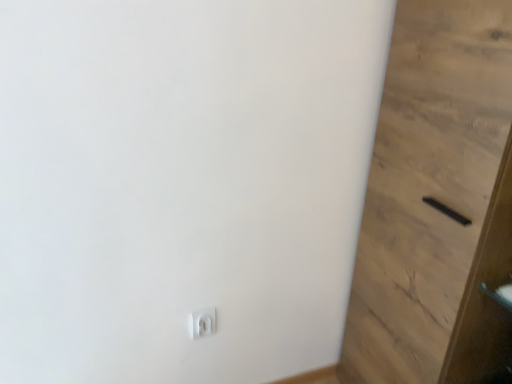
Question: Does black matte door at lower right have a greater height compared to white plastic light switch at lower center?

Choices:
 (A) no
 (B) yes

Answer: (B)

Question: Can you confirm if black matte door at lower right is shorter than white plastic light switch at lower center?

Choices:
 (A) no
 (B) yes

Answer: (A)

Question: Is black matte door at lower right completely or partially outside of white plastic light switch at lower center?

Choices:
 (A) no
 (B) yes

Answer: (B)

Question: Would you say white plastic light switch at lower center is part of black matte door at lower right's contents?

Choices:
 (A) no
 (B) yes

Answer: (A)

Question: Does black matte door at lower right have a greater width compared to white plastic light switch at lower center?

Choices:
 (A) no
 (B) yes

Answer: (B)

Question: Is black matte door at lower right positioned with its back to white plastic light switch at lower center?

Choices:
 (A) no
 (B) yes

Answer: (A)

Question: From the image's perspective, is white plastic light switch at lower center located beneath black matte door at lower right?

Choices:
 (A) no
 (B) yes

Answer: (B)

Question: Can you confirm if white plastic light switch at lower center is taller than black matte door at lower right?

Choices:
 (A) no
 (B) yes

Answer: (A)

Question: From the image's perspective, is white plastic light switch at lower center on top of black matte door at lower right?

Choices:
 (A) no
 (B) yes

Answer: (A)

Question: Is white plastic light switch at lower center thinner than black matte door at lower right?

Choices:
 (A) no
 (B) yes

Answer: (B)

Question: From a real-world perspective, is white plastic light switch at lower center beneath black matte door at lower right?

Choices:
 (A) no
 (B) yes

Answer: (B)

Question: Considering the relative sizes of white plastic light switch at lower center and black matte door at lower right in the image provided, is white plastic light switch at lower center smaller than black matte door at lower right?

Choices:
 (A) yes
 (B) no

Answer: (A)

Question: Considering the positions of black matte door at lower right and white plastic light switch at lower center in the image, is black matte door at lower right taller or shorter than white plastic light switch at lower center?

Choices:
 (A) tall
 (B) short

Answer: (A)